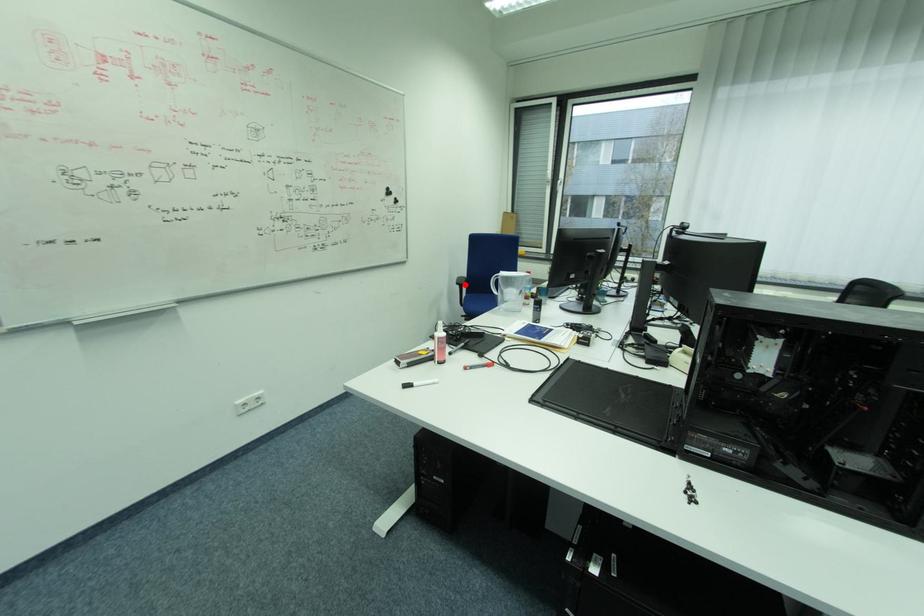
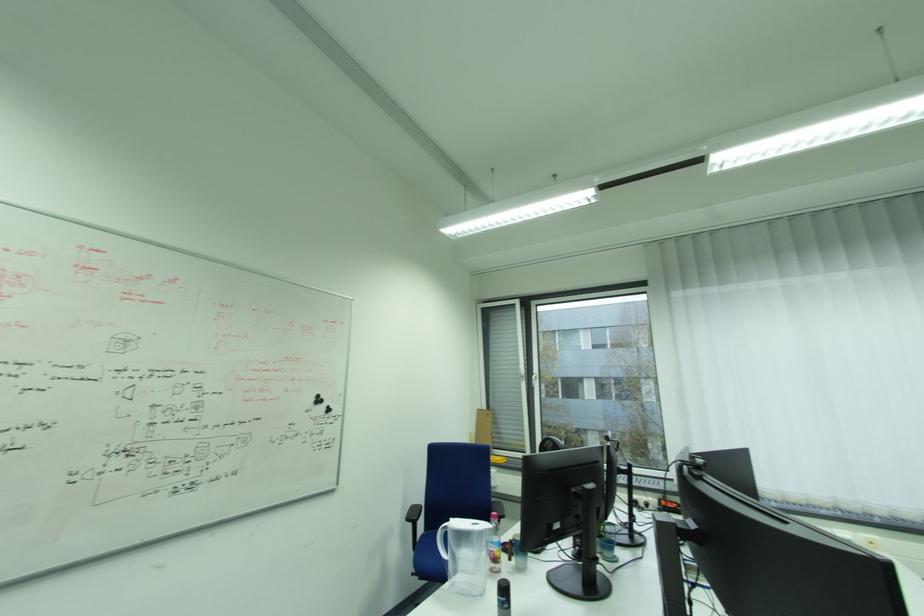
In the second image, find the point that corresponds to the highlighted location in the first image.

(415, 521)